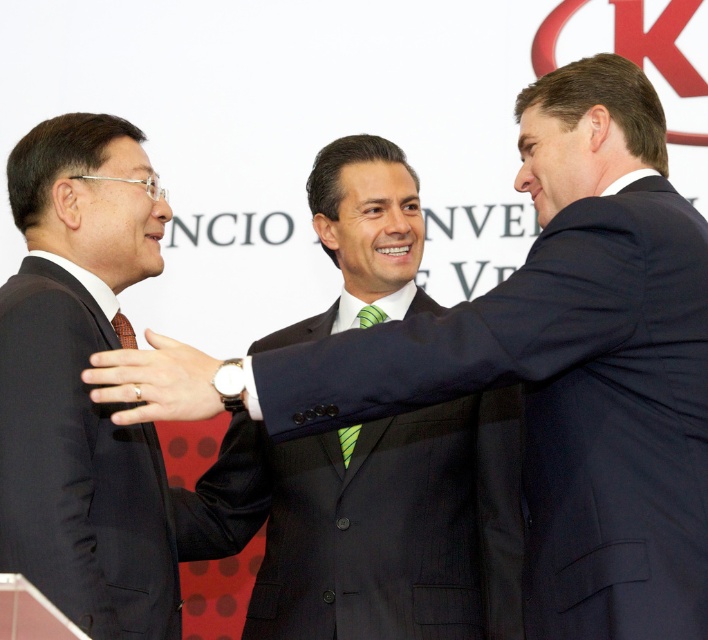
You are a photographer who needs to place a golden frame exactly at the center of the image. However, you notice the gold metallic ring at center is already placed at coordinates point 0.597, 0.220. Is the ring positioned exactly at the image center?

The gold metallic ring at center is located at point (154, 381), which is not exactly the center of the image since the true center would be at point (354, 320). Therefore, the ring is slightly offset to the right and lower than the true center.